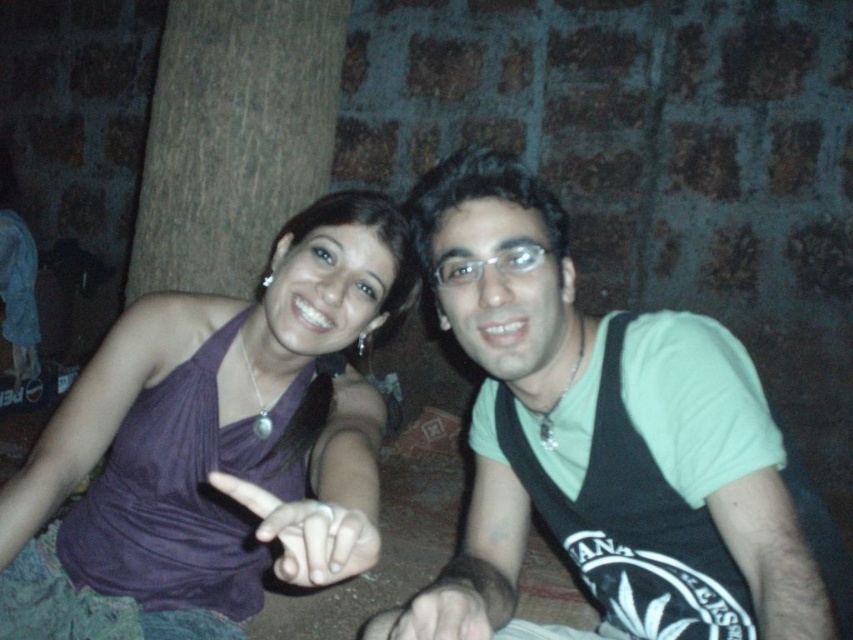
Who is positioned more to the left, green matte shirt at center or smooth skin hand at center?

smooth skin hand at center is more to the left.

Is point (619, 394) more distant than point (456, 582)?

Yes, it is behind point (456, 582).

The width and height of the screenshot is (853, 640). I want to click on green matte shirt at center, so click(608, 428).

Measure the distance between purple satin dress at center and smooth skin hand at center.

A distance of 14.34 inches exists between purple satin dress at center and smooth skin hand at center.

Where is `purple satin dress at center`? Image resolution: width=853 pixels, height=640 pixels. purple satin dress at center is located at coordinates (212, 445).

Who is positioned more to the left, green matte shirt at center or purple satin dress at center?

From the viewer's perspective, purple satin dress at center appears more on the left side.

Does green matte shirt at center come in front of purple satin dress at center?

No, green matte shirt at center is behind purple satin dress at center.

What do you see at coordinates (608, 428) in the screenshot? The image size is (853, 640). I see `green matte shirt at center` at bounding box center [608, 428].

Locate an element on the screen. green matte shirt at center is located at coordinates (608, 428).